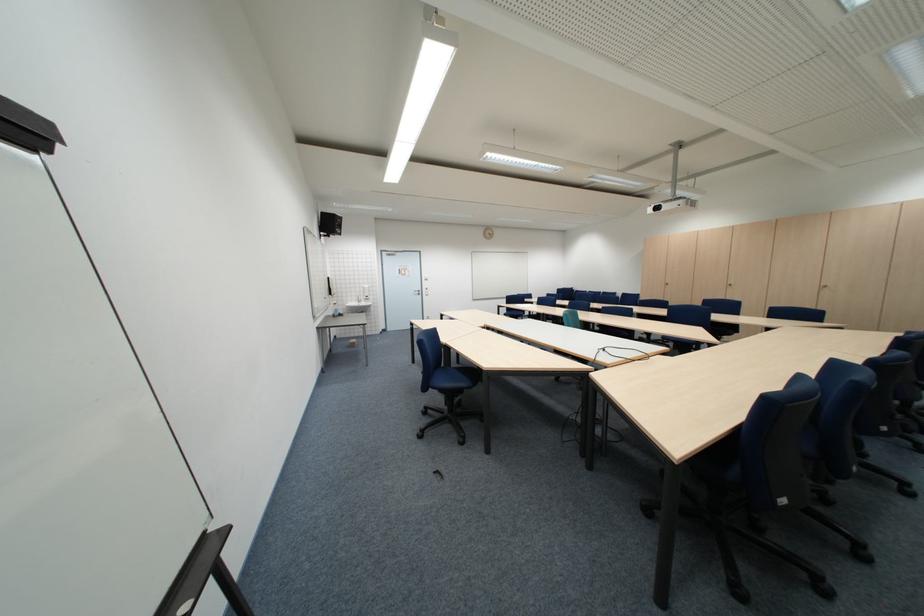
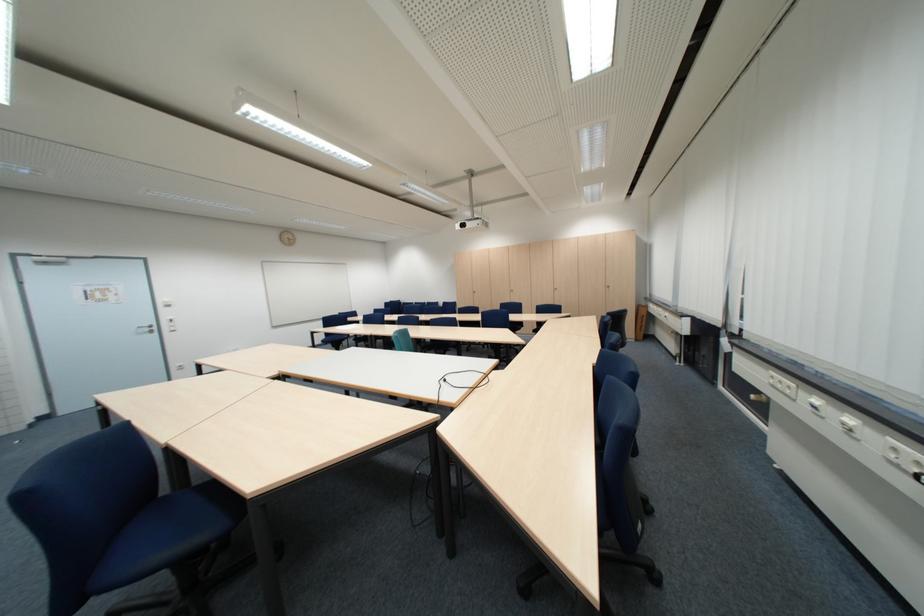
Question: Based on the continuous images, in which direction is the camera rotating? Reply with the corresponding letter.

Choices:
 (A) Left
 (B) Right
 (C) Up
 (D) Down

Answer: (B)